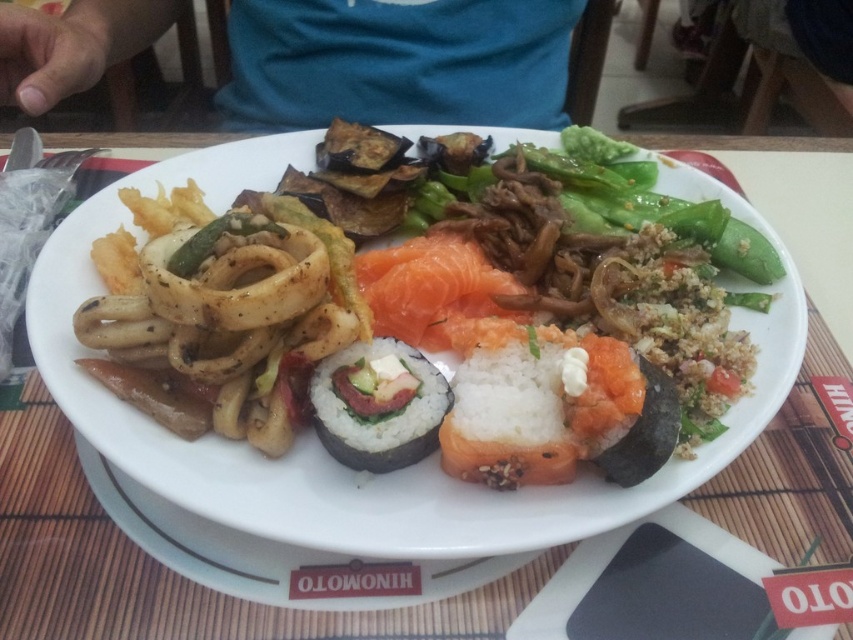
Who is more forward, (447, 392) or (451, 234)?

Point (447, 392) is in front.

Between sushi at center and pink raw salmon at center, which one has more height?

With more height is pink raw salmon at center.

Is point (404, 390) positioned in front of point (396, 296)?

Yes.

You are a GUI agent. You are given a task and a screenshot of the screen. Output one action in this format:
    pyautogui.click(x=<x>, y=<y>)
    Task: Click on the sushi at center
    
    Given the screenshot: What is the action you would take?
    pyautogui.click(x=378, y=404)

Is white glossy plate at center wider than pink raw salmon at center?

Yes.

Looking at this image, can you confirm if white glossy plate at center is positioned to the right of pink raw salmon at center?

Incorrect, white glossy plate at center is not on the right side of pink raw salmon at center.

The width and height of the screenshot is (853, 640). I want to click on white glossy plate at center, so click(317, 440).

This screenshot has width=853, height=640. What are the coordinates of `white glossy plate at center` in the screenshot? It's located at (317, 440).

Is green leafy vegetable at center wider than sushi at center?

Yes.

This screenshot has width=853, height=640. Describe the element at coordinates (647, 204) in the screenshot. I see `green leafy vegetable at center` at that location.

Image resolution: width=853 pixels, height=640 pixels. I want to click on green leafy vegetable at center, so click(647, 204).